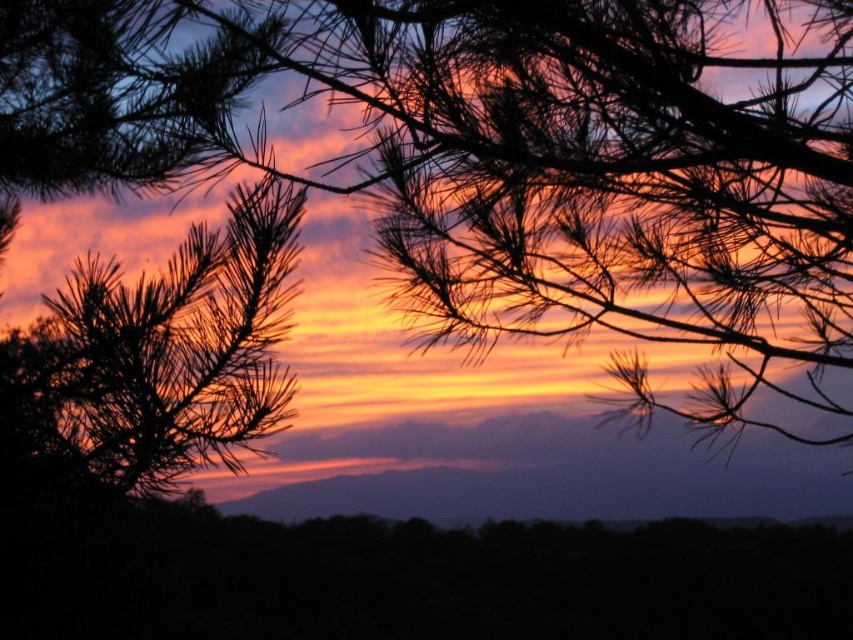
You are an artist trying to paint this sunset scene. You notice two pine branches in the foreground. The first is the silky dark green pine branches at upper center, and the second is the silky brown pine branch at left. Which of these branches should you paint wider in your artwork to stay true to the scene?

The silky dark green pine branches at upper center should be painted wider because their width surpasses that of the silky brown pine branch at left.

You are standing in the sunset scene and want to place a small decorative rock. You have two options for placement based on the coordinates given. Which point, point (387, 189) or point (61, 349), is closer to you where you are standing?

Point (387, 189) is closer to the viewer than point (61, 349), so you should place the rock there if you want it closer.